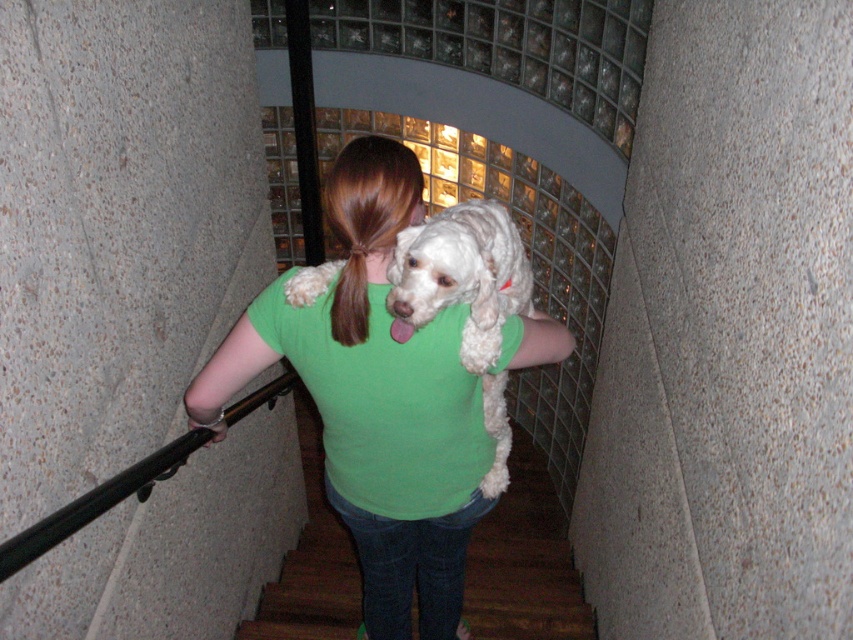
Is point (381, 308) behind point (451, 228)?

That is True.

Which is above, green cotton shirt at center or white fluffy dog at center?

white fluffy dog at center

Who is more forward, (334, 506) or (494, 202)?

Point (494, 202)

At what (x,y) coordinates should I click in order to perform the action: click on green cotton shirt at center. Please return your answer as a coordinate pair (x, y). This screenshot has height=640, width=853. Looking at the image, I should click on (375, 401).